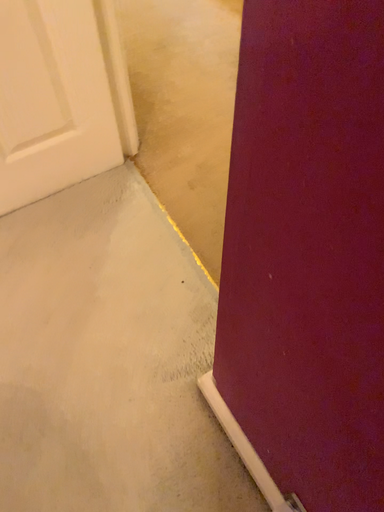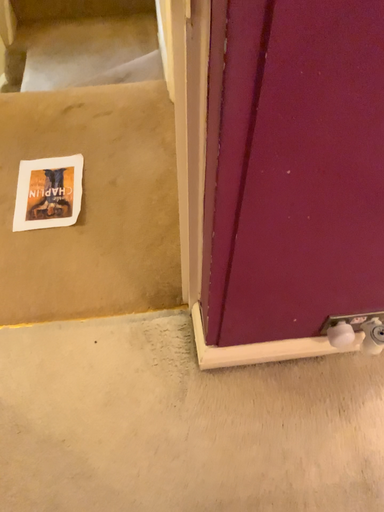
Question: How did the camera likely rotate when shooting the video?

Choices:
 (A) rotated downward
 (B) rotated upward

Answer: (B)